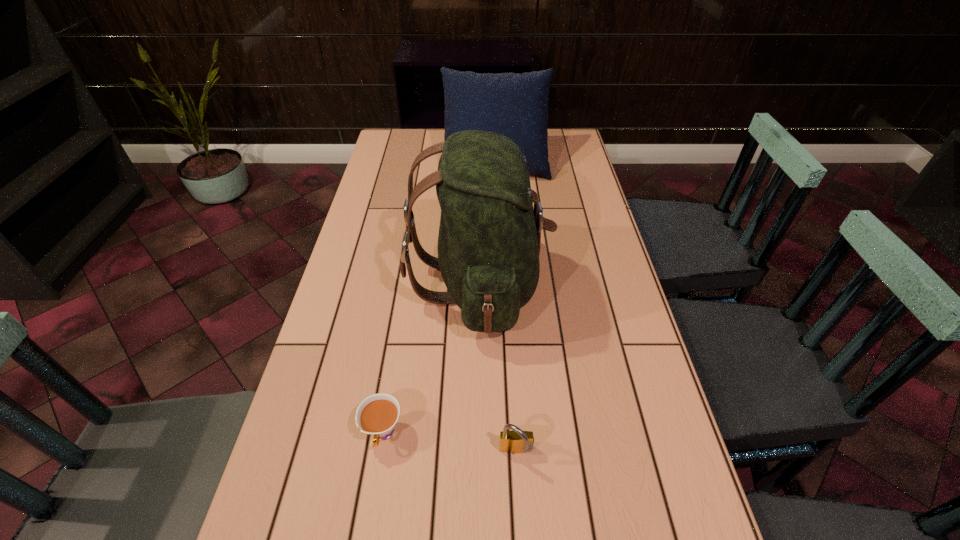
I want to click on object present at the far edge, so click(x=515, y=105).

Locate an element on the screen. The width and height of the screenshot is (960, 540). object located at the left edge is located at coordinates (377, 415).

Locate an element on the screen. Image resolution: width=960 pixels, height=540 pixels. object that is positioned at the right edge is located at coordinates (515, 105).

Locate an element on the screen. object present at the far right corner is located at coordinates (515, 105).

You are a GUI agent. You are given a task and a screenshot of the screen. Output one action in this format:
    pyautogui.click(x=<x>, y=<y>)
    Task: Click on the vacant space at the far edge of the desktop
    This screenshot has height=540, width=960.
    Given the screenshot: What is the action you would take?
    pyautogui.click(x=433, y=132)

Where is `vacant area at the left edge of the desktop`? This screenshot has width=960, height=540. vacant area at the left edge of the desktop is located at coordinates 362,363.

Locate an element on the screen. The image size is (960, 540). blank space at the right edge is located at coordinates (577, 162).

Find the location of `vacant area between the backpack and the third tallest object`. vacant area between the backpack and the third tallest object is located at coordinates (497, 368).

Locate an element on the screen. This screenshot has height=540, width=960. free space between the shortest object and the tallest object is located at coordinates (431, 359).

The width and height of the screenshot is (960, 540). I want to click on free space between the shortest object and the padlock, so tap(449, 443).